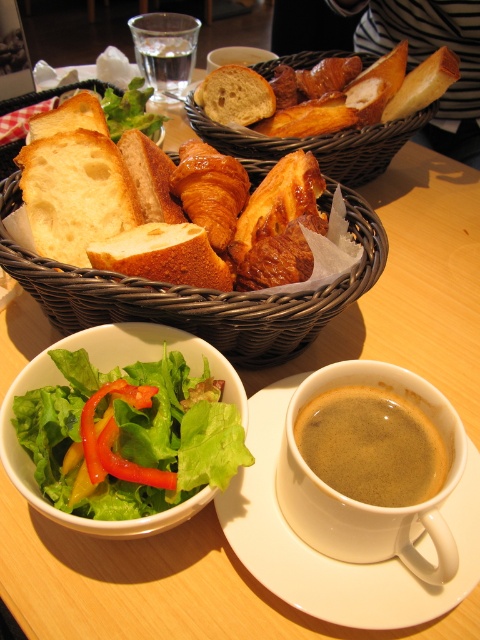
Question: Which object is positioned closest to the clear glass water at upper center?

Choices:
 (A) woven brown basket at center
 (B) white matte bread at center
 (C) golden brown wicker basket at upper center
 (D) brown matte cup at lower center

Answer: (C)

Question: Is golden brown wicker basket at upper center behind golden brown croissant at center?

Choices:
 (A) yes
 (B) no

Answer: (A)

Question: Which object is the farthest from the golden brown wicker basket at upper center?

Choices:
 (A) woven brown basket at center
 (B) golden brown croissant at center
 (C) white ceramic saucer at lower center
 (D) white matte bread at center

Answer: (C)

Question: Which point is closer to the camera?

Choices:
 (A) golden brown crusty bread at center
 (B) brown matte cup at lower center
 (C) green leafy salad at lower left
 (D) golden brown wicker basket at upper center

Answer: (C)

Question: From the image, what is the correct spatial relationship of woven brown basket at center in relation to white matte bread at center?

Choices:
 (A) below
 (B) above

Answer: (B)

Question: Can you confirm if brown matte cup at lower center is thinner than white porous bread at left?

Choices:
 (A) no
 (B) yes

Answer: (B)